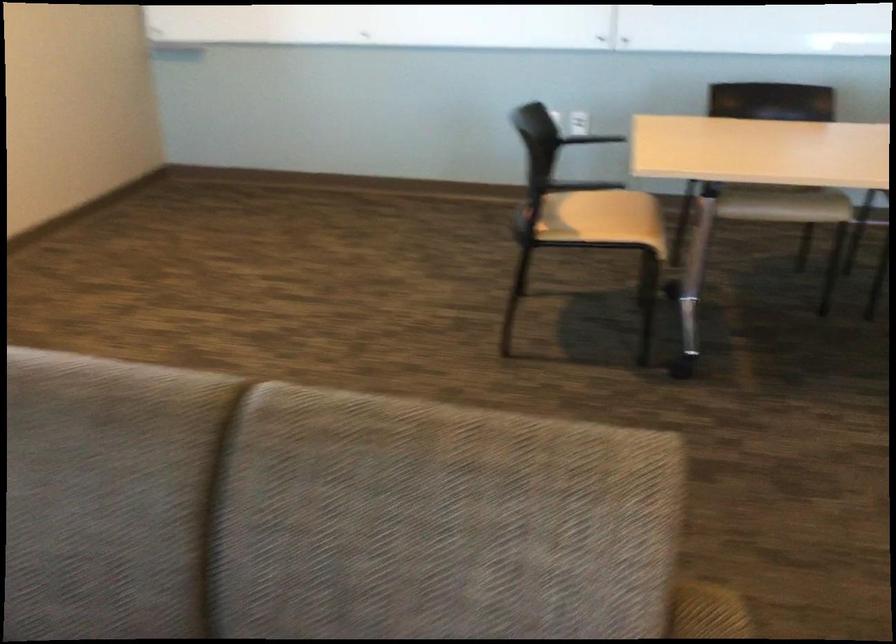
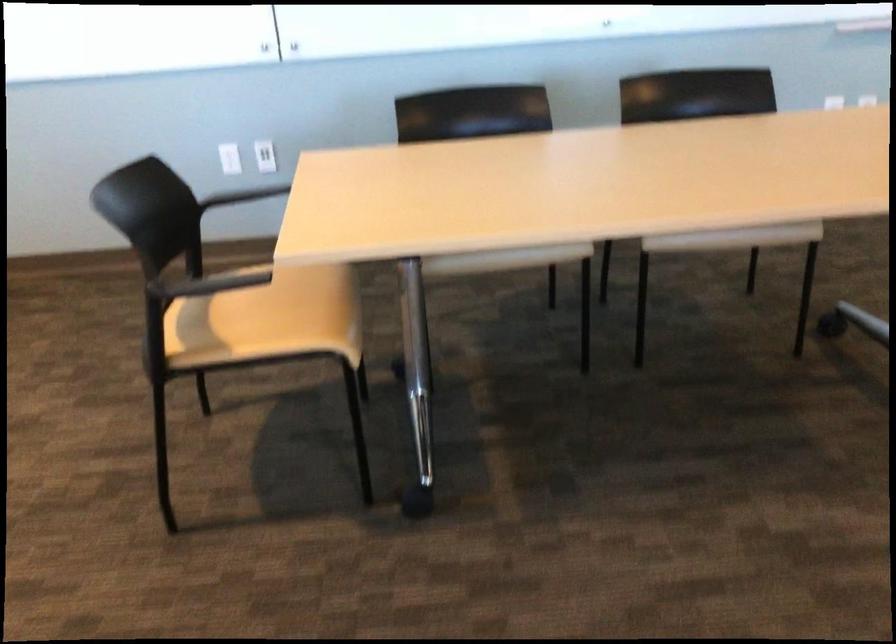
Question: How did the camera likely rotate?

Choices:
 (A) Left
 (B) Right
 (C) Up
 (D) Down

Answer: (B)